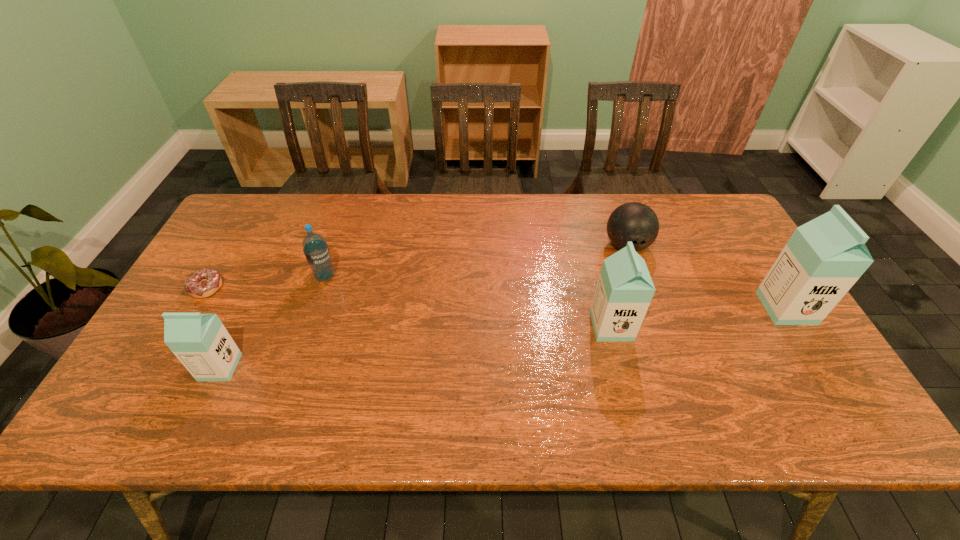
Where is `the nearest milk carton`? The image size is (960, 540). the nearest milk carton is located at coordinates (200, 341).

You are a GUI agent. You are given a task and a screenshot of the screen. Output one action in this format:
    pyautogui.click(x=<x>, y=<y>)
    Task: Click on the shortest milk carton
    
    Given the screenshot: What is the action you would take?
    pyautogui.click(x=200, y=341)

You are a GUI agent. You are given a task and a screenshot of the screen. Output one action in this format:
    pyautogui.click(x=<x>, y=<y>)
    Task: Click on the fifth shortest object
    
    Given the screenshot: What is the action you would take?
    pyautogui.click(x=624, y=291)

The height and width of the screenshot is (540, 960). In order to click on the second milk carton from right to left in this screenshot , I will do `click(624, 291)`.

You are a GUI agent. You are given a task and a screenshot of the screen. Output one action in this format:
    pyautogui.click(x=<x>, y=<y>)
    Task: Click on the tallest object
    
    Given the screenshot: What is the action you would take?
    pyautogui.click(x=823, y=259)

Find the location of a particular element. the tallest milk carton is located at coordinates (823, 259).

Image resolution: width=960 pixels, height=540 pixels. In order to click on the fifth tallest object in this screenshot , I will do `click(635, 222)`.

The width and height of the screenshot is (960, 540). Identify the location of the farthest object. tap(635, 222).

Identify the location of the fourth object from right to left. (316, 250).

The height and width of the screenshot is (540, 960). Identify the location of the leftmost object. (203, 283).